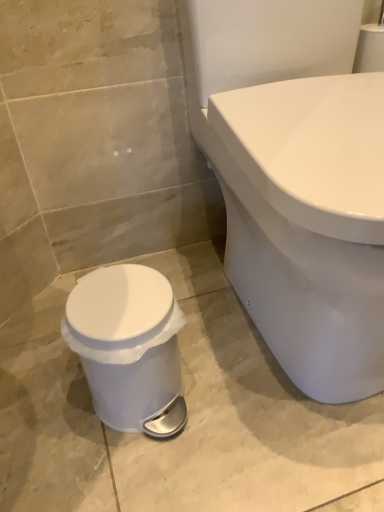
The width and height of the screenshot is (384, 512). What do you see at coordinates (307, 223) in the screenshot?
I see `white glossy toilet at lower right` at bounding box center [307, 223].

Identify the location of white glossy toilet at lower right. (307, 223).

Locate an element on the screen. The height and width of the screenshot is (512, 384). white glossy toilet at lower right is located at coordinates (307, 223).